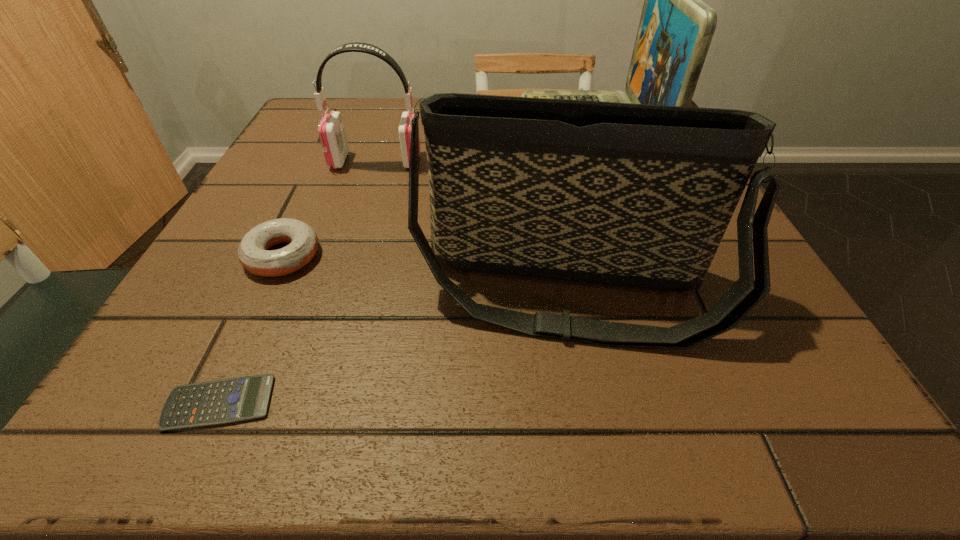
Image resolution: width=960 pixels, height=540 pixels. What are the coordinates of `object situated at the near left corner` in the screenshot? It's located at (230, 400).

You are a GUI agent. You are given a task and a screenshot of the screen. Output one action in this format:
    pyautogui.click(x=<x>, y=<y>)
    Task: Click on the object that is at the far right corner
    
    Given the screenshot: What is the action you would take?
    pyautogui.click(x=676, y=27)

You are a GUI agent. You are given a task and a screenshot of the screen. Output one action in this format:
    pyautogui.click(x=<x>, y=<y>)
    Task: Click on the free space at the far edge of the desktop
    
    Given the screenshot: What is the action you would take?
    pyautogui.click(x=376, y=135)

This screenshot has width=960, height=540. In order to click on vacant space at the near edge of the desktop in this screenshot , I will do tap(653, 383).

Where is `free location at the left edge`? The image size is (960, 540). free location at the left edge is located at coordinates (339, 185).

The height and width of the screenshot is (540, 960). In order to click on free space at the far left corner of the desktop in this screenshot , I will do `click(311, 100)`.

Locate an element on the screen. Image resolution: width=960 pixels, height=540 pixels. free space at the near left corner of the desktop is located at coordinates (190, 433).

This screenshot has width=960, height=540. I want to click on free space at the near right corner of the desktop, so click(x=847, y=414).

This screenshot has width=960, height=540. What are the coordinates of `free point between the earphone and the shortest object` in the screenshot? It's located at (298, 282).

You are a GUI agent. You are given a task and a screenshot of the screen. Output one action in this format:
    pyautogui.click(x=<x>, y=<y>)
    Task: Click on the free area in between the handbag and the shortest object
    
    Given the screenshot: What is the action you would take?
    pyautogui.click(x=393, y=347)